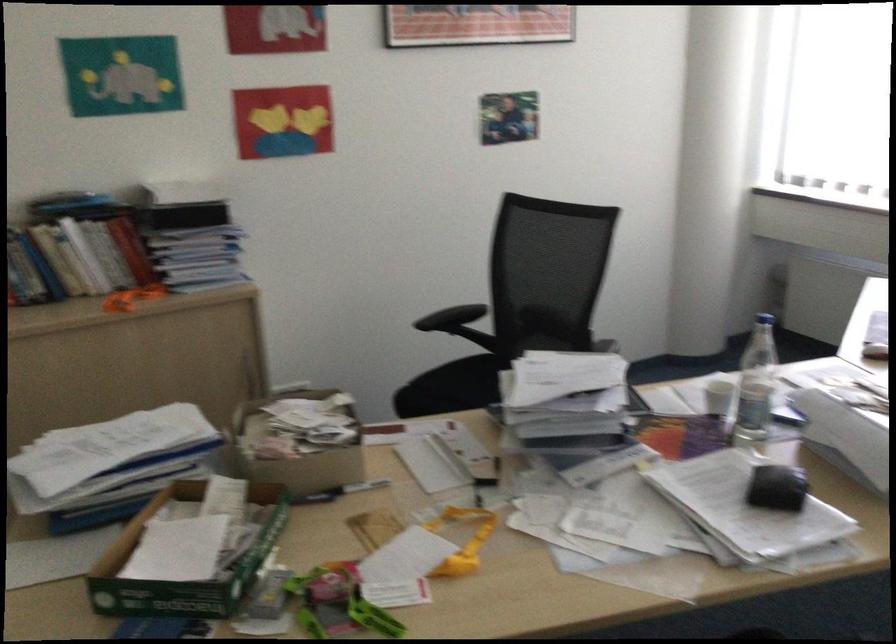
The width and height of the screenshot is (896, 644). In order to click on black chair armrest in this screenshot , I will do pos(451,317).